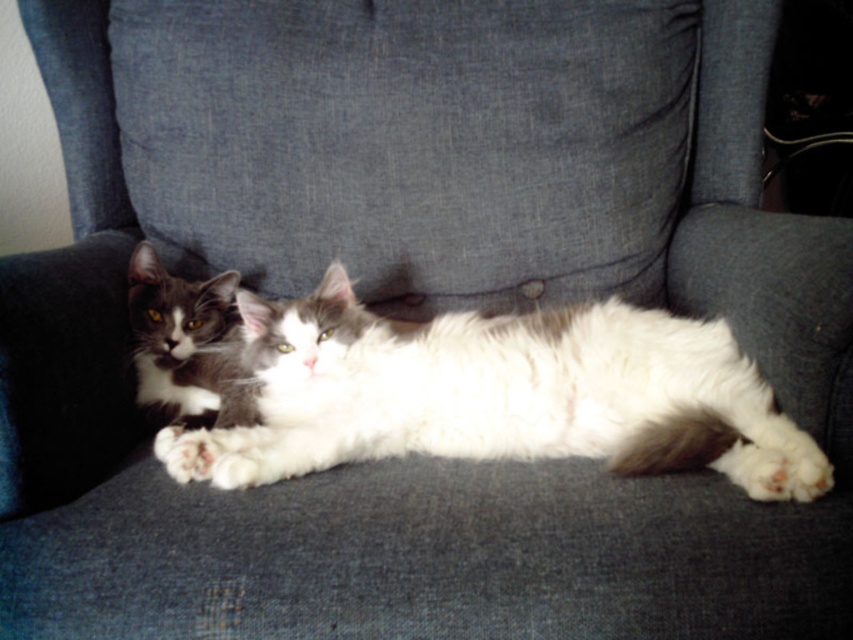
You are a cat owner who wants to place a small toy between the white fluffy cat at center and the gray fur cat at left. The toy requires a minimum of 12 inches of space to fit. Based on the scene, can the toy be placed between them?

The distance between the white fluffy cat at center and the gray fur cat at left is 10.27 inches, which is less than the required 12 inches. Therefore, the toy cannot be placed between them.